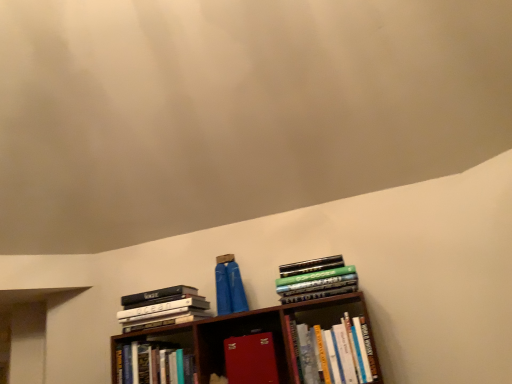
Question: Is hardcover books at center, which is the first book in right-to-left order, aimed at hardcover books at upper right, the second book when ordered from right to left?

Choices:
 (A) no
 (B) yes

Answer: (A)

Question: Is hardcover books at center, which is the first book in right-to-left order, far from hardcover books at upper right, acting as the 4th book starting from the left?

Choices:
 (A) yes
 (B) no

Answer: (B)

Question: Is the depth of hardcover books at center, which is the first book in right-to-left order, less than that of hardcover books at upper right, acting as the 4th book starting from the left?

Choices:
 (A) yes
 (B) no

Answer: (A)

Question: From the image's perspective, is hardcover books at center, the 5th book in the left-to-right sequence, above hardcover books at upper right, acting as the 4th book starting from the left?

Choices:
 (A) yes
 (B) no

Answer: (B)

Question: From the image's perspective, does hardcover books at center, the 5th book in the left-to-right sequence, appear lower than hardcover books at upper right, acting as the 4th book starting from the left?

Choices:
 (A) no
 (B) yes

Answer: (B)

Question: Considering the relative sizes of hardcover books at center, which is the first book in right-to-left order, and hardcover books at upper right, acting as the 4th book starting from the left, in the image provided, is hardcover books at center, which is the first book in right-to-left order, wider than hardcover books at upper right, acting as the 4th book starting from the left,?

Choices:
 (A) no
 (B) yes

Answer: (A)

Question: Does hardcover books at center, the 5th book in the left-to-right sequence, have a smaller size compared to hardcover books at left, placed as the 1th book when sorted from left to right?

Choices:
 (A) yes
 (B) no

Answer: (B)

Question: From a real-world perspective, is hardcover books at center, which is the first book in right-to-left order, physically above hardcover books at left, placed as the 1th book when sorted from left to right?

Choices:
 (A) no
 (B) yes

Answer: (A)

Question: Is hardcover books at center, which is the first book in right-to-left order, further to the viewer compared to hardcover books at left, the fifth book when ordered from right to left?

Choices:
 (A) yes
 (B) no

Answer: (B)

Question: Is hardcover books at center, which is the first book in right-to-left order, looking in the opposite direction of hardcover books at left, the fifth book when ordered from right to left?

Choices:
 (A) no
 (B) yes

Answer: (A)

Question: Is hardcover books at center, which is the first book in right-to-left order, wider than hardcover books at left, placed as the 1th book when sorted from left to right?

Choices:
 (A) yes
 (B) no

Answer: (B)

Question: From the image's perspective, is hardcover books at center, the 5th book in the left-to-right sequence, below hardcover books at left, the fifth book when ordered from right to left?

Choices:
 (A) yes
 (B) no

Answer: (A)

Question: Is hardcover books at left, placed as the 1th book when sorted from left to right, to the left of hardcover books at center, the 5th book in the left-to-right sequence, from the viewer's perspective?

Choices:
 (A) no
 (B) yes

Answer: (B)